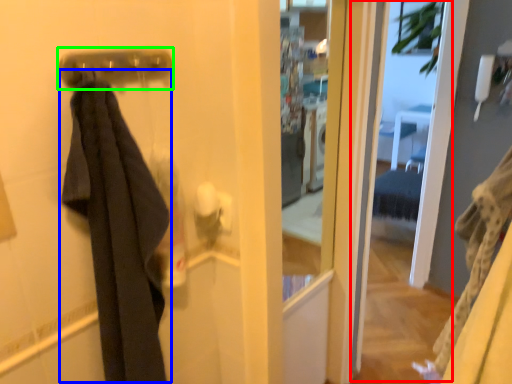
Question: Estimate the real-world distances between objects in this image. Which object is farther from screen door (highlighted by a red box), clothing (highlighted by a blue box) or door handle (highlighted by a green box)?

Choices:
 (A) clothing
 (B) door handle

Answer: (B)